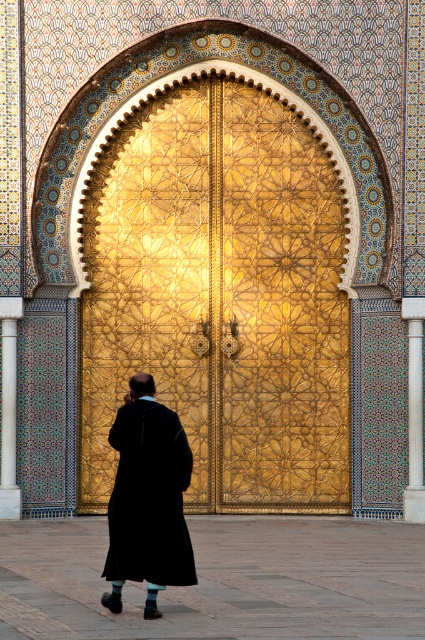
Does white marble pillar at right have a greater width compared to polished marble pillar at center?

Yes.

Does point (408, 426) lie behind point (10, 470)?

Yes.

Where is `white marble pillar at right`? white marble pillar at right is located at coordinates (414, 410).

Is point (201, 401) farther from viewer compared to point (142, 474)?

Yes, it is behind point (142, 474).

Is gold textured door at center smaller than black woolen robe at center?

Correct, gold textured door at center occupies less space than black woolen robe at center.

Who is more forward, (207,314) or (121,576)?

Point (121,576) is in front.

Identify the location of gold textured door at center. Image resolution: width=425 pixels, height=640 pixels. (220, 298).

Which is more to the left, black woolen robe at center or white marble pillar at right?

Positioned to the left is black woolen robe at center.

I want to click on black woolen robe at center, so (149, 497).